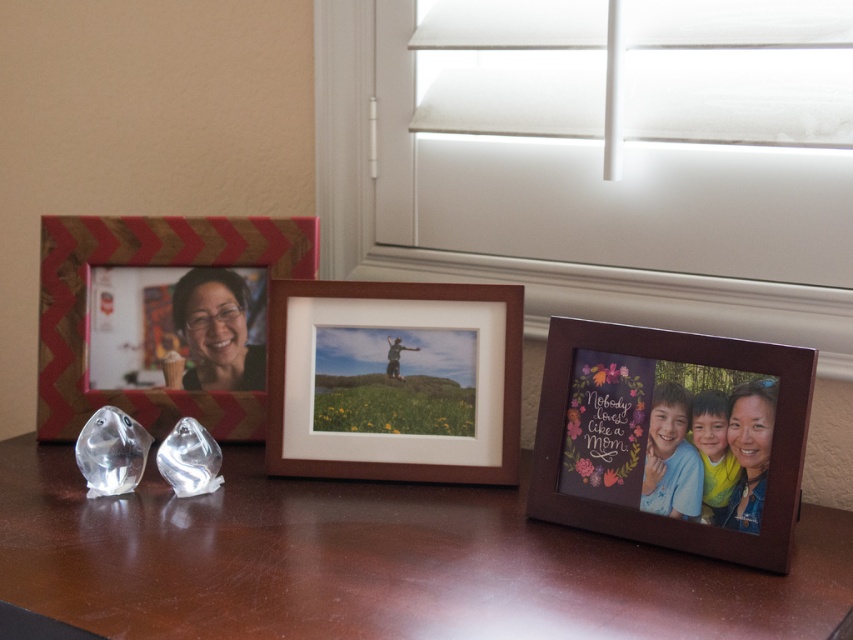
Based on the photo, is wooden photo frame at right taller than chevron-patterned wood frame at left?

No.

This screenshot has width=853, height=640. Describe the element at coordinates (670, 436) in the screenshot. I see `wooden photo frame at right` at that location.

Is point (790, 356) positioned before point (254, 397)?

Yes, it is.

Find the location of a particular element. This screenshot has width=853, height=640. wooden photo frame at right is located at coordinates (670, 436).

Who is more forward, (271, 348) or (752, 424)?

Point (752, 424) is in front.

Measure the distance between brown matte photo frame at center and matte wooden photo frame at lower right.

brown matte photo frame at center is 33.41 centimeters from matte wooden photo frame at lower right.

Image resolution: width=853 pixels, height=640 pixels. What do you see at coordinates (393, 380) in the screenshot?
I see `brown matte photo frame at center` at bounding box center [393, 380].

Where is `brown matte photo frame at center`? This screenshot has width=853, height=640. brown matte photo frame at center is located at coordinates [x=393, y=380].

Between brown wooden table at center and chevron-patterned wood frame at left, which one appears on the left side from the viewer's perspective?

From the viewer's perspective, chevron-patterned wood frame at left appears more on the left side.

Which is more to the right, brown wooden table at center or chevron-patterned wood frame at left?

brown wooden table at center is more to the right.

This screenshot has width=853, height=640. I want to click on brown wooden table at center, so click(x=375, y=563).